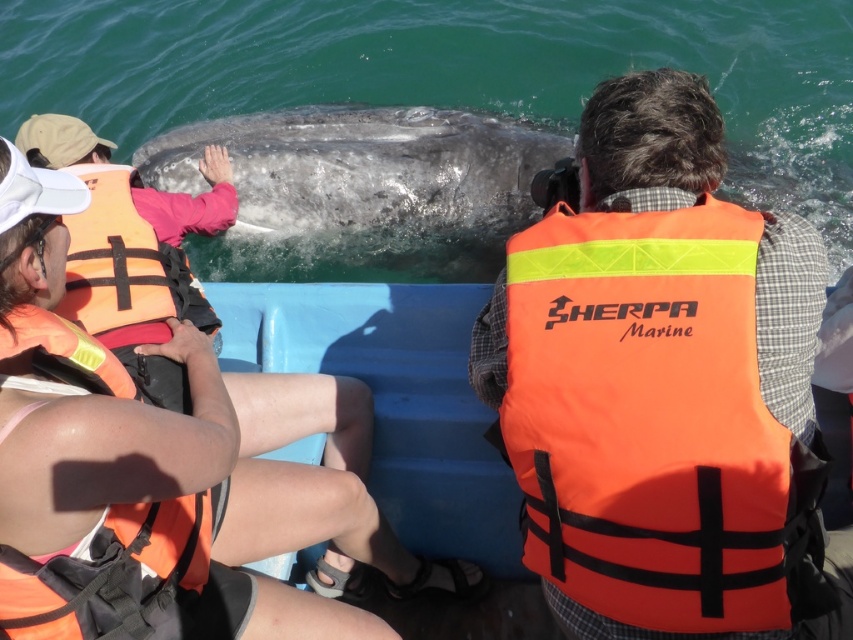
Who is positioned more to the right, glossy water at whale center or orange life jacket at left?

orange life jacket at left

This screenshot has width=853, height=640. Identify the location of glossy water at whale center. pos(456,72).

Does point (405, 100) come farther from viewer compared to point (138, 337)?

That is True.

Where is `glossy water at whale center`? This screenshot has width=853, height=640. glossy water at whale center is located at coordinates (456, 72).

Measure the distance between orange life vest at center and glossy water at whale center.

3.20 meters

How distant is orange life vest at center from glossy water at whale center?

10.50 feet

Measure the distance between point (640, 250) and camera.

Point (640, 250) and camera are 2.30 meters apart.

Identify the location of orange life vest at center. Image resolution: width=853 pixels, height=640 pixels. (656, 380).

Consider the image. Does glossy water at whale center appear under orange fabric life jacket at lower left?

No.

Does glossy water at whale center have a lesser height compared to orange fabric life jacket at lower left?

No, glossy water at whale center is not shorter than orange fabric life jacket at lower left.

Is point (439, 54) closer to viewer compared to point (177, 580)?

No, it is not.

This screenshot has height=640, width=853. I want to click on glossy water at whale center, so click(x=456, y=72).